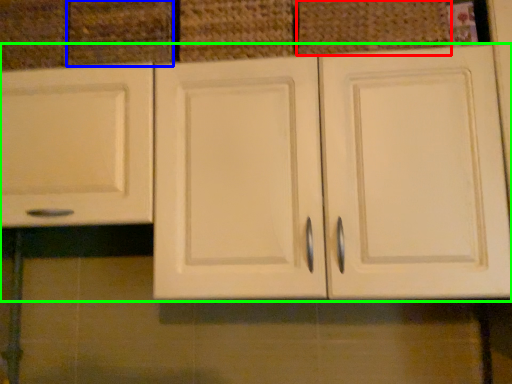
Question: Which is farther away from basket (highlighted by a red box)? drawer (highlighted by a blue box) or cabinetry (highlighted by a green box)?

Choices:
 (A) drawer
 (B) cabinetry

Answer: (A)